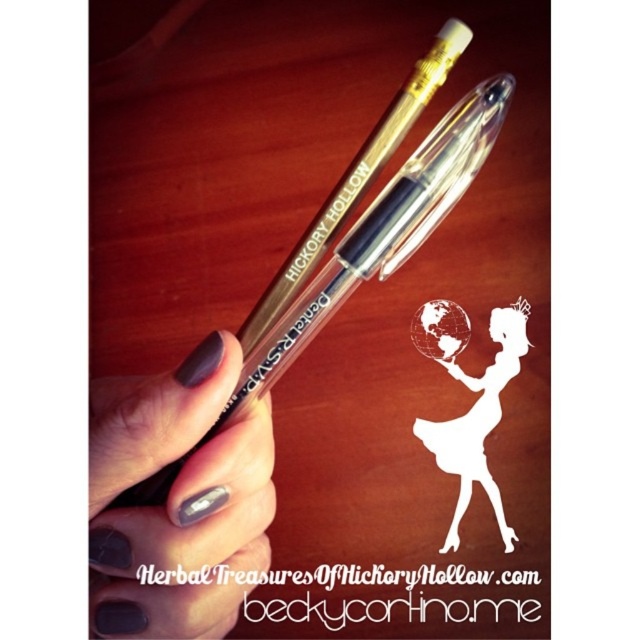
Looking at this image, you are an artist trying to place a matte gray nail polish at lower left and a white paper silhouette at center on your desk. Based on the scene, which object is positioned lower on the desk?

The matte gray nail polish at lower left is located below the white paper silhouette at center, so it is positioned lower on the desk.

You are an artist trying to reach for the clear plastic pen at center while holding the matte gray nail polish at lower left. Which object would you need to move first to access the pen?

The matte gray nail polish at lower left is closer to the viewer than the clear plastic pen at center. To access the clear plastic pen at center, you would need to move the matte gray nail polish at lower left first.